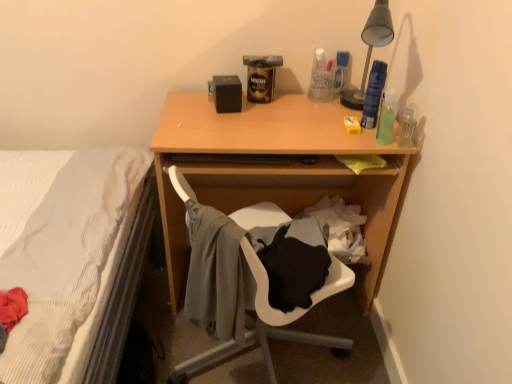
The height and width of the screenshot is (384, 512). Describe the element at coordinates (260, 325) in the screenshot. I see `gray fabric chair at lower center` at that location.

Describe the element at coordinates (387, 117) in the screenshot. I see `translucent green bottle at right, marked as the 1th bottle in a front-to-back arrangement` at that location.

Measure the distance between point (230, 137) and camera.

Point (230, 137) is 1.28 meters away from camera.

At what (x,y) coordinates should I click in order to perform the action: click on wooden desk at center. Please return your answer as a coordinate pair (x, y). Looking at the image, I should click on (273, 170).

Image resolution: width=512 pixels, height=384 pixels. Find the location of `translucent plastic spray can at upper right, positioned as the second bottle in back-to-front order`. translucent plastic spray can at upper right, positioned as the second bottle in back-to-front order is located at coordinates (373, 94).

This screenshot has height=384, width=512. Identify the location of gray fabric chair at lower center. tap(260, 325).

Looking at this image, is black matte speaker at upper center turned away from gray fabric chair at lower center?

black matte speaker at upper center is not turned away from gray fabric chair at lower center.

Between point (214, 78) and point (234, 217), which one is positioned behind?

The point (214, 78) is more distant.

Can we say black matte speaker at upper center lies outside gray fabric chair at lower center?

Yes, black matte speaker at upper center is not within gray fabric chair at lower center.

Is point (342, 74) closer to camera compared to point (335, 270)?

No, (342, 74) is behind (335, 270).

Who is more distant, translucent plastic bottle at upper right, which is the fourth bottle from front to back, or gray fabric chair at lower center?

Positioned behind is translucent plastic bottle at upper right, which is the fourth bottle from front to back.

Which object is thinner, translucent plastic bottle at upper right, which is the fourth bottle from front to back, or gray fabric chair at lower center?

Thinner between the two is translucent plastic bottle at upper right, which is the fourth bottle from front to back.

Is translucent plastic bottle at upper right, placed as the 1th bottle when sorted from back to front, in contact with gray fabric chair at lower center?

No, translucent plastic bottle at upper right, placed as the 1th bottle when sorted from back to front, is not in contact with gray fabric chair at lower center.

Is wooden desk at center positioned far away from translucent plastic spray can at upper right, positioned as the second bottle in back-to-front order?

wooden desk at center is actually quite close to translucent plastic spray can at upper right, positioned as the second bottle in back-to-front order.

Would you say wooden desk at center is outside translucent plastic spray can at upper right, marked as the 3th bottle in a front-to-back arrangement?

Yes, wooden desk at center is located beyond the bounds of translucent plastic spray can at upper right, marked as the 3th bottle in a front-to-back arrangement.

Can you confirm if wooden desk at center is shorter than translucent plastic spray can at upper right, positioned as the second bottle in back-to-front order?

No.

Considering the relative sizes of wooden desk at center and translucent plastic spray can at upper right, positioned as the second bottle in back-to-front order, in the image provided, is wooden desk at center smaller than translucent plastic spray can at upper right, positioned as the second bottle in back-to-front order,?

No, wooden desk at center is not smaller than translucent plastic spray can at upper right, positioned as the second bottle in back-to-front order.

Is translucent green bottle at right, arranged as the fourth bottle when viewed from the back, at the left side of gray fabric chair at lower center?

Incorrect, translucent green bottle at right, arranged as the fourth bottle when viewed from the back, is not on the left side of gray fabric chair at lower center.

You are a GUI agent. You are given a task and a screenshot of the screen. Output one action in this format:
    pyautogui.click(x=<x>, y=<y>)
    Task: Click on the chair below the translucent green bottle at right, arranged as the fourth bottle when viewed from the back (from the image's perspective)
    The image size is (512, 384).
    Given the screenshot: What is the action you would take?
    pyautogui.click(x=260, y=325)

Which is more distant, (391, 112) or (260, 323)?

Positioned behind is point (391, 112).

From the image's perspective, is translucent green bottle at right, arranged as the fourth bottle when viewed from the back, over gray fabric chair at lower center?

Yes, from the image's perspective, translucent green bottle at right, arranged as the fourth bottle when viewed from the back, is above gray fabric chair at lower center.

Between translucent plastic spray can at upper right, positioned as the second bottle in back-to-front order, and clear plastic bottle at right, the second bottle from the front, which one appears on the left side from the viewer's perspective?

translucent plastic spray can at upper right, positioned as the second bottle in back-to-front order.

From a real-world perspective, does translucent plastic spray can at upper right, positioned as the second bottle in back-to-front order, sit lower than clear plastic bottle at right, which is the 3th bottle in back-to-front order?

No.

Considering the relative sizes of translucent plastic spray can at upper right, positioned as the second bottle in back-to-front order, and clear plastic bottle at right, the second bottle from the front, in the image provided, is translucent plastic spray can at upper right, positioned as the second bottle in back-to-front order, taller than clear plastic bottle at right, the second bottle from the front,?

Yes.

The width and height of the screenshot is (512, 384). In order to click on the 3rd bottle located beneath the translucent plastic spray can at upper right, marked as the 3th bottle in a front-to-back arrangement (from a real-world perspective) in this screenshot , I will do `click(408, 125)`.

The height and width of the screenshot is (384, 512). In order to click on desk located behind the gray fabric chair at lower center in this screenshot , I will do (273, 170).

In terms of size, does wooden desk at center appear bigger or smaller than gray fabric chair at lower center?

Clearly, wooden desk at center is larger in size than gray fabric chair at lower center.

Which is more to the right, wooden desk at center or gray fabric chair at lower center?

Positioned to the right is wooden desk at center.

How many degrees apart are the facing directions of wooden desk at center and gray fabric chair at lower center?

The facing directions of wooden desk at center and gray fabric chair at lower center are 138 degrees apart.

Which point is more forward, (384, 117) or (408, 135)?

Point (408, 135)

Is translucent green bottle at right, arranged as the fourth bottle when viewed from the back, facing towards clear plastic bottle at right, the second bottle from the front?

No, translucent green bottle at right, arranged as the fourth bottle when viewed from the back, is not oriented towards clear plastic bottle at right, the second bottle from the front.

From a real-world perspective, is translucent green bottle at right, marked as the 1th bottle in a front-to-back arrangement, on clear plastic bottle at right, the second bottle from the front?

Yes.

There is a translucent green bottle at right, arranged as the fourth bottle when viewed from the back. At what (x,y) coordinates should I click in order to perform the action: click on the 2nd bottle below it (from a real-world perspective). Please return your answer as a coordinate pair (x, y). This screenshot has height=384, width=512. Looking at the image, I should click on [x=408, y=125].

Image resolution: width=512 pixels, height=384 pixels. I want to click on loudspeaker that is above the gray fabric chair at lower center (from the image's perspective), so 226,93.

You are a GUI agent. You are given a task and a screenshot of the screen. Output one action in this format:
    pyautogui.click(x=<x>, y=<y>)
    Task: Click on the 1st bottle to the right when counting from the gray fabric chair at lower center
    This screenshot has height=384, width=512.
    Given the screenshot: What is the action you would take?
    pyautogui.click(x=340, y=72)

Which object lies nearer to the anchor point black matte speaker at upper center, translucent plastic bottle at upper right, which is the fourth bottle from front to back, or gray fabric chair at lower center?

The object closer to black matte speaker at upper center is translucent plastic bottle at upper right, which is the fourth bottle from front to back.

From the picture: Which object lies nearer to the anchor point gray fabric chair at lower center, translucent green bottle at right, arranged as the fourth bottle when viewed from the back, or translucent plastic bottle at upper right, which is the fourth bottle from front to back?

translucent green bottle at right, arranged as the fourth bottle when viewed from the back, lies closer to gray fabric chair at lower center than the other object.

From the image, which object appears to be nearer to translucent green bottle at right, arranged as the fourth bottle when viewed from the back, translucent plastic spray can at upper right, marked as the 3th bottle in a front-to-back arrangement, or black matte speaker at upper center?

translucent plastic spray can at upper right, marked as the 3th bottle in a front-to-back arrangement.

When comparing their distances from translucent plastic spray can at upper right, positioned as the second bottle in back-to-front order, does gray fabric chair at lower center or translucent plastic bottle at upper right, which is the fourth bottle from front to back, seem closer?

translucent plastic bottle at upper right, which is the fourth bottle from front to back, is closer to translucent plastic spray can at upper right, positioned as the second bottle in back-to-front order.

From the image, which object appears to be farther from translucent plastic bottle at upper right, which is the fourth bottle from front to back, gray fabric chair at lower center or translucent plastic spray can at upper right, marked as the 3th bottle in a front-to-back arrangement?

The object further to translucent plastic bottle at upper right, which is the fourth bottle from front to back, is gray fabric chair at lower center.

Considering their positions, is translucent plastic spray can at upper right, marked as the 3th bottle in a front-to-back arrangement, positioned further to black matte speaker at upper center than translucent plastic bottle at upper right, which is the fourth bottle from front to back?

Among the two, translucent plastic spray can at upper right, marked as the 3th bottle in a front-to-back arrangement, is located further to black matte speaker at upper center.

Based on the photo, from the image, which object appears to be nearer to gray fabric chair at lower center, black matte speaker at upper center or translucent plastic spray can at upper right, marked as the 3th bottle in a front-to-back arrangement?

The object closer to gray fabric chair at lower center is black matte speaker at upper center.

Estimate the real-world distances between objects in this image. Which object is further from clear plastic bottle at right, which is the 3th bottle in back-to-front order, black matte speaker at upper center or wooden desk at center?

black matte speaker at upper center is further to clear plastic bottle at right, which is the 3th bottle in back-to-front order.

Find the location of `desk between translucent plastic spray can at upper right, marked as the 3th bottle in a front-to-back arrangement, and gray fabric chair at lower center, in the vertical direction`. desk between translucent plastic spray can at upper right, marked as the 3th bottle in a front-to-back arrangement, and gray fabric chair at lower center, in the vertical direction is located at coordinates [x=273, y=170].

Locate an element on the screen. desk between translucent green bottle at right, arranged as the fourth bottle when viewed from the back, and gray fabric chair at lower center from top to bottom is located at coordinates (273, 170).

This screenshot has height=384, width=512. I want to click on bottle between translucent green bottle at right, arranged as the fourth bottle when viewed from the back, and gray fabric chair at lower center from top to bottom, so point(408,125).

The height and width of the screenshot is (384, 512). I want to click on desk between gray fabric chair at lower center and clear plastic bottle at right, which is the 3th bottle in back-to-front order, so click(273, 170).